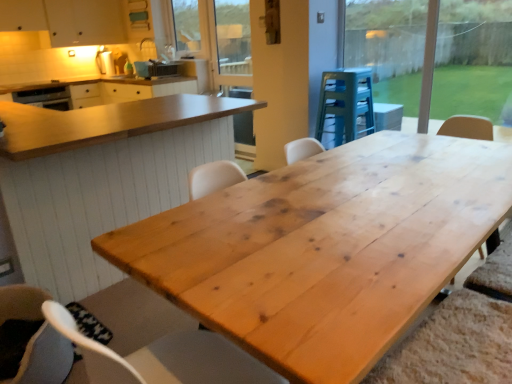
The image size is (512, 384). I want to click on wooden screen door at upper center, so pos(233,46).

Describe the element at coordinates (346, 103) in the screenshot. I see `wooden stool at center, which is counted as the second appliance, starting from the back` at that location.

Image resolution: width=512 pixels, height=384 pixels. Describe the element at coordinates (45, 358) in the screenshot. I see `soft gray fabric chair at lower left` at that location.

This screenshot has width=512, height=384. Find the location of `matte black toaster at upper center, the 1th appliance from the top`. matte black toaster at upper center, the 1th appliance from the top is located at coordinates (155, 69).

Locate an element on the screen. wooden screen door at upper center is located at coordinates [233, 46].

From a real-world perspective, is natural wood table at center, which is the second table from front to back, physically located above or below clear glass window screen at upper center?

natural wood table at center, which is the second table from front to back, is below clear glass window screen at upper center.

Is natural wood table at center, which is the second table from front to back, far from clear glass window screen at upper center?

Yes.

How many degrees apart are the facing directions of natural wood table at center, which is the second table from front to back, and clear glass window screen at upper center?

The angle between the facing direction of natural wood table at center, which is the second table from front to back, and the facing direction of clear glass window screen at upper center is 92.5 degrees.

Which object is further away from the camera taking this photo, natural wood table at center, which is the second table from front to back, or transparent glass window at upper right?

transparent glass window at upper right is further from the camera.

How different are the orientations of natural wood table at center, marked as the 1th table in a back-to-front arrangement, and transparent glass window at upper right in degrees?

The facing directions of natural wood table at center, marked as the 1th table in a back-to-front arrangement, and transparent glass window at upper right are 90.3 degrees apart.

Would you say transparent glass window at upper right is part of natural wood table at center, marked as the 1th table in a back-to-front arrangement,'s contents?

That's incorrect, transparent glass window at upper right is not inside natural wood table at center, marked as the 1th table in a back-to-front arrangement.

From the image's perspective, which is above, natural wood table at center, which is the second table from front to back, or transparent glass window at upper right?

transparent glass window at upper right, from the image's perspective.

Which of these two, natural wood table at center, which is the first table from front to back, or soft gray fabric chair at lower left, is thinner?

With smaller width is soft gray fabric chair at lower left.

I want to click on the 1st table above the soft gray fabric chair at lower left (from the image's perspective), so click(x=324, y=249).

Does natural wood table at center, which is the first table from front to back, come in front of soft gray fabric chair at lower left?

Yes.

In the image, is natural wood table at center, arranged as the 2th table when viewed from the back, on the left side or the right side of soft gray fabric chair at lower left?

In the image, natural wood table at center, arranged as the 2th table when viewed from the back, appears on the right side of soft gray fabric chair at lower left.

Which of these two, clear glass window screen at upper center or natural wood table at center, which is the first table from front to back, is bigger?

natural wood table at center, which is the first table from front to back.

Is clear glass window screen at upper center turned away from natural wood table at center, which is the first table from front to back?

No, clear glass window screen at upper center's orientation is not away from natural wood table at center, which is the first table from front to back.

Is point (186, 48) farther from camera compared to point (462, 227)?

Yes, point (186, 48) is behind point (462, 227).

From the image's perspective, relative to natural wood table at center, which is the first table from front to back, is clear glass window screen at upper center above or below?

clear glass window screen at upper center is situated higher than natural wood table at center, which is the first table from front to back, in the image.

Which object is more forward, wooden stool at center, which is the 1th appliance from right to left, or clear glass window screen at upper center?

Positioned in front is wooden stool at center, which is the 1th appliance from right to left.

Based on the photo, is wooden stool at center, the second appliance positioned from the top, outside of clear glass window screen at upper center?

Yes.

Is wooden stool at center, which is the 1th appliance from right to left, facing away from clear glass window screen at upper center?

No.

Would you say clear glass window screen at upper center is part of natural wood table at center, arranged as the 2th table when viewed from the back,'s contents?

No, clear glass window screen at upper center is not surrounded by natural wood table at center, arranged as the 2th table when viewed from the back.

How much distance is there between natural wood table at center, arranged as the 2th table when viewed from the back, and clear glass window screen at upper center?

natural wood table at center, arranged as the 2th table when viewed from the back, and clear glass window screen at upper center are 4.11 meters apart.

Considering the relative sizes of natural wood table at center, which is the first table from front to back, and clear glass window screen at upper center in the image provided, is natural wood table at center, which is the first table from front to back, shorter than clear glass window screen at upper center?

No, natural wood table at center, which is the first table from front to back, is not shorter than clear glass window screen at upper center.

Looking at this image, which is more to the right, natural wood table at center, arranged as the 2th table when viewed from the back, or clear glass window screen at upper center?

From the viewer's perspective, natural wood table at center, arranged as the 2th table when viewed from the back, appears more on the right side.

Is transparent glass window at upper right surrounded by wooden screen door at upper center?

No, transparent glass window at upper right is not inside wooden screen door at upper center.

Considering the sizes of wooden screen door at upper center and transparent glass window at upper right in the image, is wooden screen door at upper center taller or shorter than transparent glass window at upper right?

In the image, wooden screen door at upper center appears to be taller than transparent glass window at upper right.

What's the angular difference between wooden screen door at upper center and transparent glass window at upper right's facing directions?

They differ by 0.208 degrees in their facing directions.

Is point (219, 5) farther from camera compared to point (503, 69)?

Yes, it is.

Where is `window screen that appears behind the natural wood table at center, which is the second table from front to back`? This screenshot has width=512, height=384. window screen that appears behind the natural wood table at center, which is the second table from front to back is located at coordinates (186, 26).

Where is `the 1st table positioned below the transparent glass window at upper right (from the image's perspective)`? the 1st table positioned below the transparent glass window at upper right (from the image's perspective) is located at coordinates (101, 177).

Looking at the image, which one is located further to clear glass window screen at upper center, natural wood table at center, marked as the 1th table in a back-to-front arrangement, or matte black toaster at upper center, acting as the first appliance starting from the left?

The object further to clear glass window screen at upper center is natural wood table at center, marked as the 1th table in a back-to-front arrangement.

Looking at the image, which one is located closer to natural wood table at center, marked as the 1th table in a back-to-front arrangement, wooden stool at center, the second appliance positioned from the top, or natural wood table at center, which is the first table from front to back?

The object closer to natural wood table at center, marked as the 1th table in a back-to-front arrangement, is natural wood table at center, which is the first table from front to back.

Considering their positions, is natural wood table at center, arranged as the 2th table when viewed from the back, positioned closer to soft gray fabric chair at lower left than matte black toaster at upper center, arranged as the 2th appliance when viewed from the right?

natural wood table at center, arranged as the 2th table when viewed from the back, is closer to soft gray fabric chair at lower left.

In the scene shown: Considering their positions, is natural wood table at center, marked as the 1th table in a back-to-front arrangement, positioned further to matte black toaster at upper center, acting as the first appliance starting from the left, than clear glass window screen at upper center?

Based on the image, natural wood table at center, marked as the 1th table in a back-to-front arrangement, appears to be further to matte black toaster at upper center, acting as the first appliance starting from the left.

In the scene shown: Looking at the image, which one is located closer to soft gray fabric chair at lower left, transparent glass window at upper right or wooden stool at center, which is counted as the second appliance, starting from the back?

wooden stool at center, which is counted as the second appliance, starting from the back, is closer to soft gray fabric chair at lower left.

Estimate the real-world distances between objects in this image. Which object is further from wooden stool at center, which ranks as the 1th appliance in front-to-back order, matte black toaster at upper center, marked as the first appliance in a back-to-front arrangement, or natural wood table at center, which is the second table from front to back?

The object further to wooden stool at center, which ranks as the 1th appliance in front-to-back order, is matte black toaster at upper center, marked as the first appliance in a back-to-front arrangement.

Looking at the image, which one is located further to soft gray fabric chair at lower left, matte black toaster at upper center, arranged as the second appliance when viewed from the front, or natural wood table at center, marked as the 1th table in a back-to-front arrangement?

matte black toaster at upper center, arranged as the second appliance when viewed from the front, is positioned further to the anchor soft gray fabric chair at lower left.

Looking at the image, which one is located further to matte black toaster at upper center, arranged as the 2th appliance when viewed from the right, wooden screen door at upper center or soft gray fabric chair at lower left?

soft gray fabric chair at lower left is further to matte black toaster at upper center, arranged as the 2th appliance when viewed from the right.

Locate an element on the screen. Image resolution: width=512 pixels, height=384 pixels. screen door situated between matte black toaster at upper center, which ranks as the 2th appliance in bottom-to-top order, and wooden stool at center, which ranks as the 1th appliance in front-to-back order, from left to right is located at coordinates (233, 46).

Find the location of a particular element. screen door between clear glass window screen at upper center and wooden stool at center, which appears as the first appliance when ordered from the bottom, in the horizontal direction is located at coordinates (233, 46).

At what (x,y) coordinates should I click in order to perform the action: click on appliance between soft gray fabric chair at lower left and matte black toaster at upper center, marked as the first appliance in a back-to-front arrangement, along the z-axis. Please return your answer as a coordinate pair (x, y). Image resolution: width=512 pixels, height=384 pixels. Looking at the image, I should click on point(346,103).

Locate an element on the screen. table located between natural wood table at center, which is the first table from front to back, and matte black toaster at upper center, arranged as the 2th appliance when viewed from the right, in the depth direction is located at coordinates (101, 177).